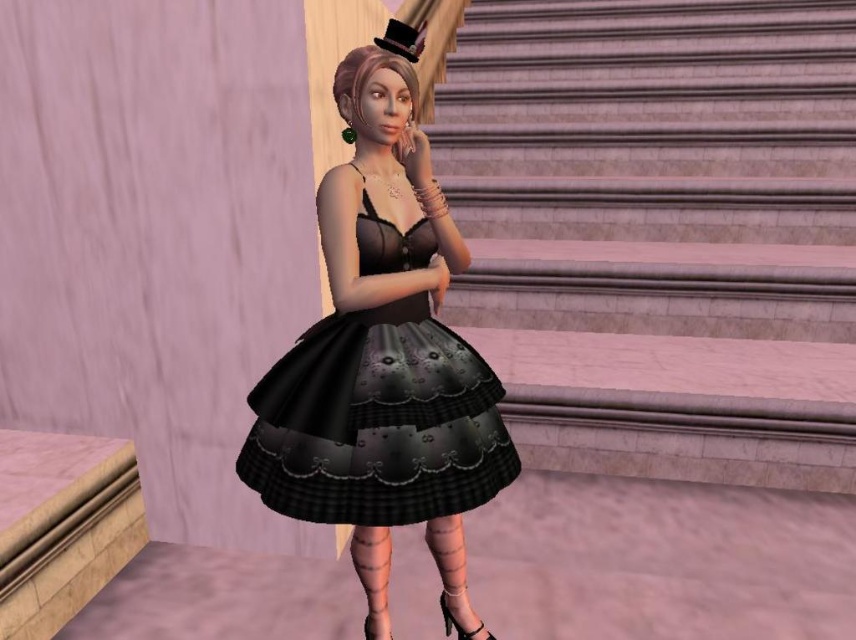
You are a fashion designer preparing for a runway show. You need to place the black satin dress at center and the black felt top hat at upper center in a way that aligns with their positions in the original image. Which object should be positioned to the right when arranging them on the runway stage?

The black felt top hat at upper center should be positioned to the right of the black satin dress at center because the black satin dress at center is to the left of the black felt top hat at upper center in the original image.

You are a character in the virtual environment standing in front of the marble stairs at center. You want to walk up to the top of the stairs. How many steps do you need to climb?

The marble stairs at center is 8.89 feet from camera. However, the number of steps required to reach the top cannot be determined from the given information. Please provide more details about the height of each step or the total number of steps available.